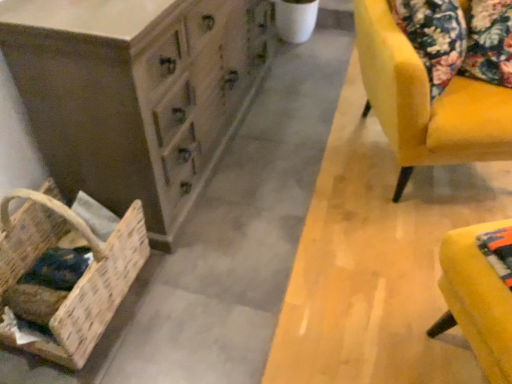
The width and height of the screenshot is (512, 384). I want to click on vacant area located to the right-hand side of woven wood basket at lower left, so click(x=187, y=299).